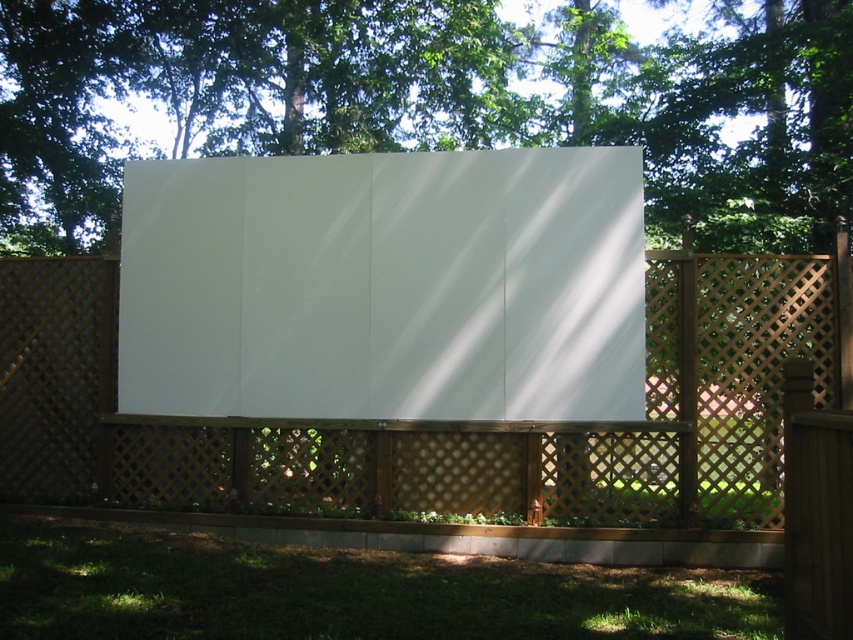
Does white matte billboard at center have a smaller size compared to wooden lattice fence at center?

No, white matte billboard at center is not smaller than wooden lattice fence at center.

Can you confirm if white matte billboard at center is wider than wooden lattice fence at center?

Indeed, white matte billboard at center has a greater width compared to wooden lattice fence at center.

Is point (395, 241) in front of point (38, 456)?

Yes, point (395, 241) is closer to viewer.

The image size is (853, 640). Find the location of `white matte billboard at center`. white matte billboard at center is located at coordinates (386, 285).

Consider the image. Who is positioned more to the left, green leafy tree at upper center or white matte billboard at center?

Positioned to the left is green leafy tree at upper center.

Does green leafy tree at upper center lie in front of white matte billboard at center?

No, green leafy tree at upper center is behind white matte billboard at center.

Is point (387, 92) positioned before point (289, 344)?

That is False.

This screenshot has height=640, width=853. Find the location of `green leafy tree at upper center`. green leafy tree at upper center is located at coordinates (431, 100).

Between green leafy tree at upper center and wooden lattice fence at center, which one has less height?

Standing shorter between the two is wooden lattice fence at center.

Which is in front, point (1, 52) or point (828, 403)?

Positioned in front is point (828, 403).

I want to click on green leafy tree at upper center, so click(431, 100).